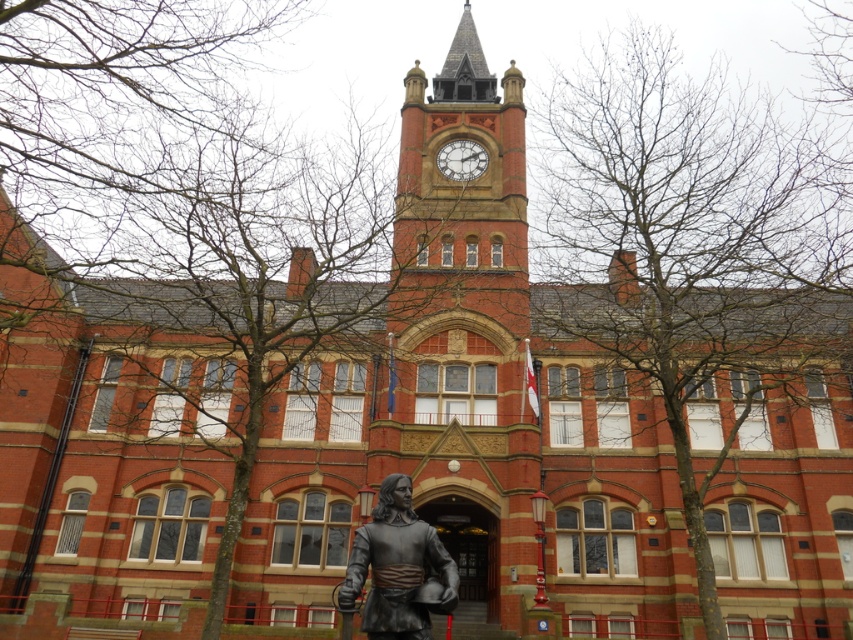
Question: Does bare branches at upper center appear under bare branches at left?

Choices:
 (A) no
 (B) yes

Answer: (B)

Question: Can you confirm if bare branches at upper center is thinner than white painted metal clock at upper center?

Choices:
 (A) no
 (B) yes

Answer: (A)

Question: Which of the following is the farthest from the observer?

Choices:
 (A) (749, 314)
 (B) (451, 164)
 (C) (265, 1)

Answer: (B)

Question: Which point is farther from the camera taking this photo?

Choices:
 (A) (451, 147)
 (B) (399, 532)

Answer: (A)

Question: Is bare branches at upper center bigger than bare branches at left?

Choices:
 (A) no
 (B) yes

Answer: (B)

Question: Among these objects, which one is nearest to the camera?

Choices:
 (A) bare branches at left
 (B) bare branches at upper center
 (C) bronze statue at center
 (D) white painted metal clock at upper center

Answer: (C)